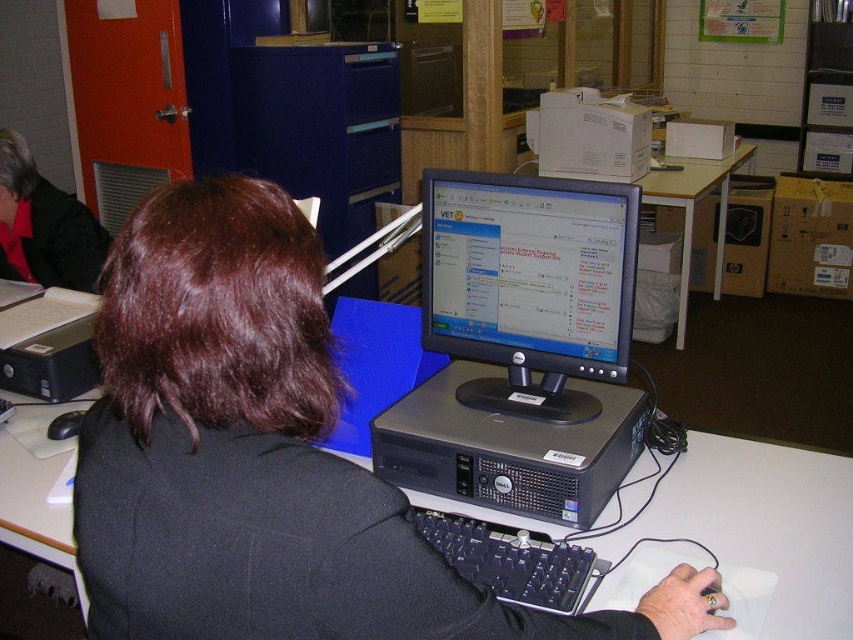
You are taking a photo of the desk in the office scene. You want to focus on both the point at coordinates point (178,353) and point (550,243). Which point should you focus on first to ensure both are in focus?

You should focus on point (178,353) first because it is closer to the camera than point (550,243), ensuring both points are within the depth of field.

You are organizing a small storage space and need to place both the black matte jacket at center and the black matte mouse at lower left. Given their sizes, which item requires more horizontal space to store?

The black matte jacket at center requires more horizontal space to store because its width is larger than that of the black matte mouse at lower left.

You are a photographer taking a picture of the office scene. You notice two points marked in the image at coordinates point (238,593) and point (689,282). Which point should you focus on to ensure it appears clearer in the photo?

Point (238,593) should be focused on because it is closer to the camera and will appear clearer in the photo compared to point (689,282), which is farther away.